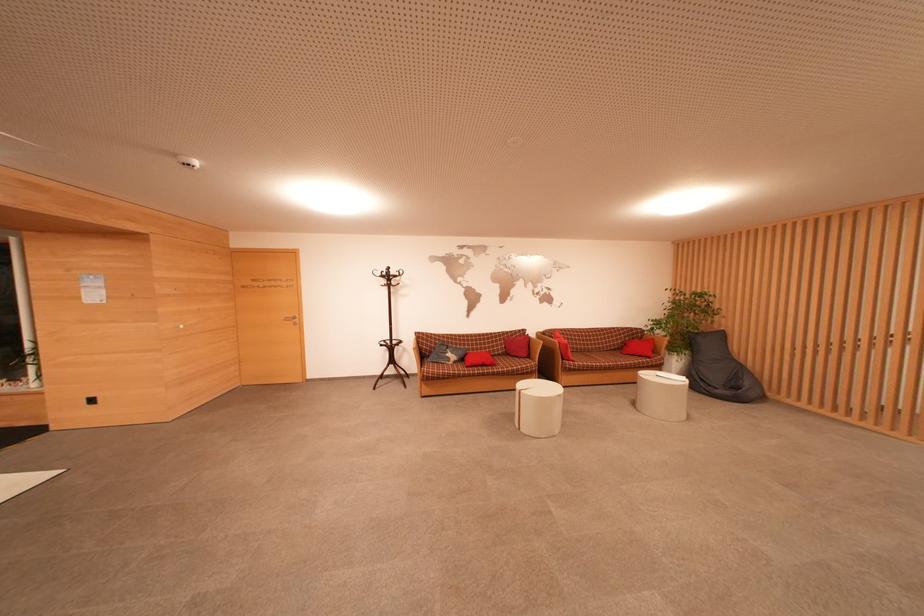
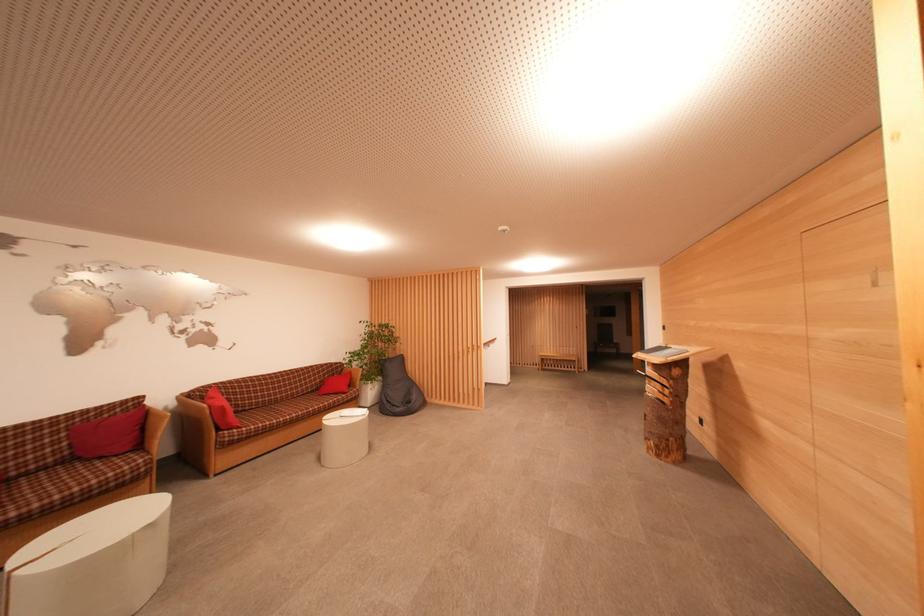
The point at [503,358] is marked in the first image. Where is the corresponding point in the second image?

(45, 472)